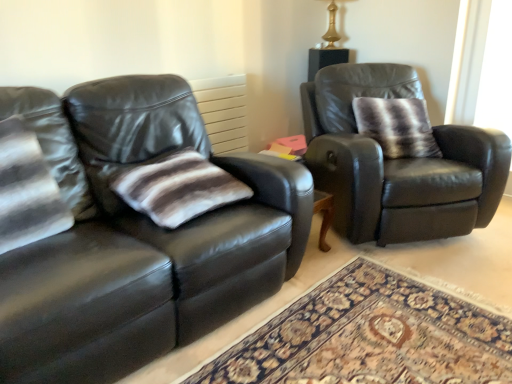
In order to face striped fur pillow at right, arranged as the second pillow when viewed from the front, should I rotate leftwards or rightwards?

You should look right and rotate roughly 18.217 degrees.

Where is `matte black leather armchair at right`? The image size is (512, 384). matte black leather armchair at right is located at coordinates (397, 163).

Find the location of a particular element. The height and width of the screenshot is (384, 512). gold metallic table lamp at upper center is located at coordinates (331, 28).

This screenshot has width=512, height=384. What are the coordinates of `striped fabric pillow at center, the 1th pillow viewed from the front` in the screenshot? It's located at coord(176,187).

This screenshot has width=512, height=384. Find the location of `striped fur pillow at right, arranged as the second pillow when viewed from the front`. striped fur pillow at right, arranged as the second pillow when viewed from the front is located at coordinates (397, 126).

Considering the relative positions of striped fur pillow at right, arranged as the second pillow when viewed from the front, and matte black couch at left in the image provided, is striped fur pillow at right, arranged as the second pillow when viewed from the front, behind matte black couch at left?

Yes, the depth of striped fur pillow at right, arranged as the second pillow when viewed from the front, is greater than that of matte black couch at left.

From a real-world perspective, is striped fur pillow at right, acting as the first pillow starting from the top, positioned under matte black couch at left based on gravity?

No, from a real-world perspective, striped fur pillow at right, acting as the first pillow starting from the top, is not below matte black couch at left.

Considering the sizes of objects striped fur pillow at right, which is the second pillow from left to right, and matte black couch at left in the image provided, who is thinner, striped fur pillow at right, which is the second pillow from left to right, or matte black couch at left?

striped fur pillow at right, which is the second pillow from left to right.

Considering the relative positions of striped fur pillow at right, arranged as the second pillow when viewed from the front, and matte black couch at left in the image provided, is striped fur pillow at right, arranged as the second pillow when viewed from the front, to the left of matte black couch at left from the viewer's perspective?

No.

Is striped fabric pillow at center, which is counted as the second pillow, starting from the back, oriented away from matte black leather armchair at right?

No, striped fabric pillow at center, which is counted as the second pillow, starting from the back, is not facing the opposite direction of matte black leather armchair at right.

Which of these two, striped fabric pillow at center, the 1th pillow viewed from the front, or matte black leather armchair at right, stands shorter?

Standing shorter between the two is striped fabric pillow at center, the 1th pillow viewed from the front.

Which is less distant, (152,160) or (318,152)?

Point (152,160).

From the image's perspective, which one is positioned lower, striped fabric pillow at center, the first pillow positioned from the left, or matte black leather armchair at right?

striped fabric pillow at center, the first pillow positioned from the left.

Considering the positions of points (479, 205) and (82, 134), is point (479, 205) farther from camera compared to point (82, 134)?

That is True.

Is matte black leather armchair at right in front of or behind matte black couch at left in the image?

matte black leather armchair at right is behind matte black couch at left.

Looking at this image, considering the relative sizes of matte black leather armchair at right and matte black couch at left in the image provided, is matte black leather armchair at right smaller than matte black couch at left?

Yes.

Measure the distance between matte black leather armchair at right and matte black couch at left.

matte black leather armchair at right and matte black couch at left are 37.23 inches apart from each other.

Which object is more forward, striped fabric pillow at center, arranged as the 2th pillow when viewed from the right, or gold metallic table lamp at upper center?

striped fabric pillow at center, arranged as the 2th pillow when viewed from the right, is in front.

What's the angular difference between striped fabric pillow at center, positioned as the second pillow in top-to-bottom order, and gold metallic table lamp at upper center's facing directions?

They differ by 88.1 degrees in their facing directions.

From the image's perspective, is striped fabric pillow at center, positioned as the second pillow in top-to-bottom order, positioned above or below gold metallic table lamp at upper center?

striped fabric pillow at center, positioned as the second pillow in top-to-bottom order, is below gold metallic table lamp at upper center.

Locate an element on the screen. Image resolution: width=512 pixels, height=384 pixels. pillow on the left of the gold metallic table lamp at upper center is located at coordinates pyautogui.click(x=176, y=187).

Looking at their sizes, would you say striped fur pillow at right, marked as the 1th pillow in a back-to-front arrangement, is wider or thinner than striped fabric pillow at center, which is counted as the second pillow, starting from the back?

Considering their sizes, striped fur pillow at right, marked as the 1th pillow in a back-to-front arrangement, looks slimmer than striped fabric pillow at center, which is counted as the second pillow, starting from the back.

From the picture: Looking at the image, does striped fur pillow at right, acting as the first pillow starting from the top, seem bigger or smaller compared to striped fabric pillow at center, which is counted as the second pillow, starting from the back?

In the image, striped fur pillow at right, acting as the first pillow starting from the top, appears to be larger than striped fabric pillow at center, which is counted as the second pillow, starting from the back.

Does striped fur pillow at right, the 1th pillow when ordered from right to left, lie in front of striped fabric pillow at center, which is counted as the second pillow, starting from the back?

No, the depth of striped fur pillow at right, the 1th pillow when ordered from right to left, is greater than that of striped fabric pillow at center, which is counted as the second pillow, starting from the back.

Does matte black leather armchair at right have a lesser height compared to striped fur pillow at right, which ranks as the second pillow in bottom-to-top order?

In fact, matte black leather armchair at right may be taller than striped fur pillow at right, which ranks as the second pillow in bottom-to-top order.

Is matte black leather armchair at right oriented away from striped fur pillow at right, the 1th pillow when ordered from right to left?

That's right, matte black leather armchair at right is facing away from striped fur pillow at right, the 1th pillow when ordered from right to left.

Does point (422, 234) lie behind point (435, 152)?

No.

Based on the photo, is matte black leather armchair at right bigger than striped fur pillow at right, marked as the 1th pillow in a back-to-front arrangement?

Yes.

You are a GUI agent. You are given a task and a screenshot of the screen. Output one action in this format:
    pyautogui.click(x=<x>, y=<y>)
    Task: Click on the 1st pillow located beneath the gold metallic table lamp at upper center (from a real-world perspective)
    The height and width of the screenshot is (384, 512).
    Given the screenshot: What is the action you would take?
    point(397,126)

Between striped fur pillow at right, the 1th pillow when ordered from right to left, and gold metallic table lamp at upper center, which one is positioned behind?

gold metallic table lamp at upper center.

Could you tell me if striped fur pillow at right, which ranks as the second pillow in bottom-to-top order, is facing gold metallic table lamp at upper center?

No.

Is point (425, 130) positioned behind point (327, 33)?

No, it is in front of (327, 33).

At what (x,y) coordinates should I click in order to perform the action: click on pillow that is the 2nd one when counting rightward from the matte black couch at left. Please return your answer as a coordinate pair (x, y). This screenshot has height=384, width=512. Looking at the image, I should click on (397, 126).

Locate an element on the screen. pillow that appears on the left of matte black leather armchair at right is located at coordinates (176, 187).

Which object lies nearer to the anchor point gold metallic table lamp at upper center, matte black leather armchair at right or striped fabric pillow at center, positioned as the second pillow in top-to-bottom order?

matte black leather armchair at right.

Which object lies further to the anchor point matte black leather armchair at right, matte black couch at left or striped fabric pillow at center, which ranks as the 1th pillow in bottom-to-top order?

striped fabric pillow at center, which ranks as the 1th pillow in bottom-to-top order, is positioned further to the anchor matte black leather armchair at right.

Which object lies further to the anchor point striped fur pillow at right, acting as the first pillow starting from the top, gold metallic table lamp at upper center or matte black couch at left?

Based on the image, matte black couch at left appears to be further to striped fur pillow at right, acting as the first pillow starting from the top.

When comparing their distances from matte black leather armchair at right, does striped fabric pillow at center, arranged as the 2th pillow when viewed from the right, or striped fur pillow at right, which is the second pillow from left to right, seem further?

Among the two, striped fabric pillow at center, arranged as the 2th pillow when viewed from the right, is located further to matte black leather armchair at right.

Which object lies nearer to the anchor point striped fabric pillow at center, positioned as the second pillow in top-to-bottom order, striped fur pillow at right, acting as the first pillow starting from the top, or matte black couch at left?

Based on the image, matte black couch at left appears to be nearer to striped fabric pillow at center, positioned as the second pillow in top-to-bottom order.

When comparing their distances from matte black leather armchair at right, does gold metallic table lamp at upper center or matte black couch at left seem closer?

matte black couch at left is closer to matte black leather armchair at right.

From the image, which object appears to be nearer to matte black leather armchair at right, striped fur pillow at right, arranged as the second pillow when viewed from the front, or striped fabric pillow at center, which ranks as the 1th pillow in bottom-to-top order?

striped fur pillow at right, arranged as the second pillow when viewed from the front.

When comparing their distances from striped fur pillow at right, the 1th pillow when ordered from right to left, does matte black leather armchair at right or gold metallic table lamp at upper center seem further?

Among the two, gold metallic table lamp at upper center is located further to striped fur pillow at right, the 1th pillow when ordered from right to left.

The height and width of the screenshot is (384, 512). I want to click on pillow between striped fabric pillow at center, which ranks as the 1th pillow in bottom-to-top order, and gold metallic table lamp at upper center, along the z-axis, so click(397, 126).

Locate an element on the screen. This screenshot has height=384, width=512. chair between striped fabric pillow at center, positioned as the second pillow in top-to-bottom order, and gold metallic table lamp at upper center in the front-back direction is located at coordinates (397, 163).

Find the location of `pillow between matte black couch at left and matte black leather armchair at right from left to right`. pillow between matte black couch at left and matte black leather armchair at right from left to right is located at coordinates (176, 187).

Locate an element on the screen. This screenshot has height=384, width=512. chair situated between matte black couch at left and striped fur pillow at right, the 1th pillow when ordered from right to left, from left to right is located at coordinates [397, 163].